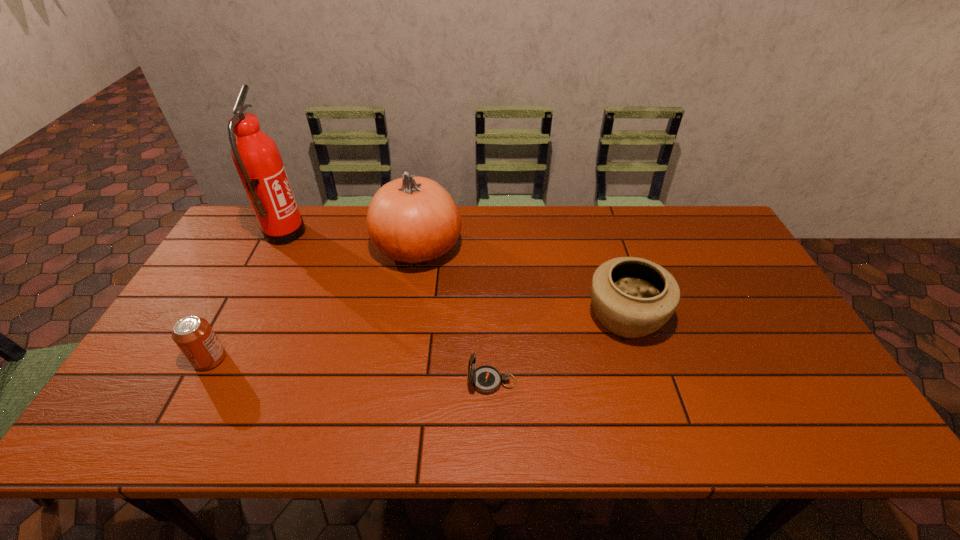
This screenshot has height=540, width=960. In order to click on free space between the second shortest object and the pottery in this screenshot , I will do `click(418, 338)`.

Where is `free spot between the rightmost object and the second tallest object`? The height and width of the screenshot is (540, 960). free spot between the rightmost object and the second tallest object is located at coordinates (521, 282).

Where is `empty space that is in between the pottery and the pumpkin`? empty space that is in between the pottery and the pumpkin is located at coordinates (521, 282).

Point out which object is positioned as the third nearest to the fourth object from left to right. Please provide its 2D coordinates. Your answer should be formatted as a tuple, i.e. [(x, y)], where the tuple contains the x and y coordinates of a point satisfying the conditions above.

[(194, 336)]

Choose which object is the fourth nearest neighbor to the fourth tallest object. Please provide its 2D coordinates. Your answer should be formatted as a tuple, i.e. [(x, y)], where the tuple contains the x and y coordinates of a point satisfying the conditions above.

[(632, 297)]

I want to click on vacant region that satisfies the following two spatial constraints: 1. on the front side of the pottery; 2. on the face of the fourth object from left to right, so click(645, 382).

This screenshot has width=960, height=540. What are the coordinates of `free space that satisfies the following two spatial constraints: 1. on the label side of the pumpkin; 2. on the left side of the fire extinguisher` in the screenshot? It's located at (276, 248).

Identify the location of free space that satisfies the following two spatial constraints: 1. on the label side of the third tallest object; 2. on the right side of the fire extinguisher. This screenshot has width=960, height=540. (241, 318).

At what (x,y) coordinates should I click in order to perform the action: click on free location that satisfies the following two spatial constraints: 1. on the label side of the tallest object; 2. on the right side of the pottery. Please return your answer as a coordinate pair (x, y). The image size is (960, 540). Looking at the image, I should click on (241, 318).

At what (x,y) coordinates should I click in order to perform the action: click on vacant space that satisfies the following two spatial constraints: 1. on the back side of the rightmost object; 2. on the label side of the tallest object. Please return your answer as a coordinate pair (x, y). This screenshot has height=540, width=960. Looking at the image, I should click on (599, 234).